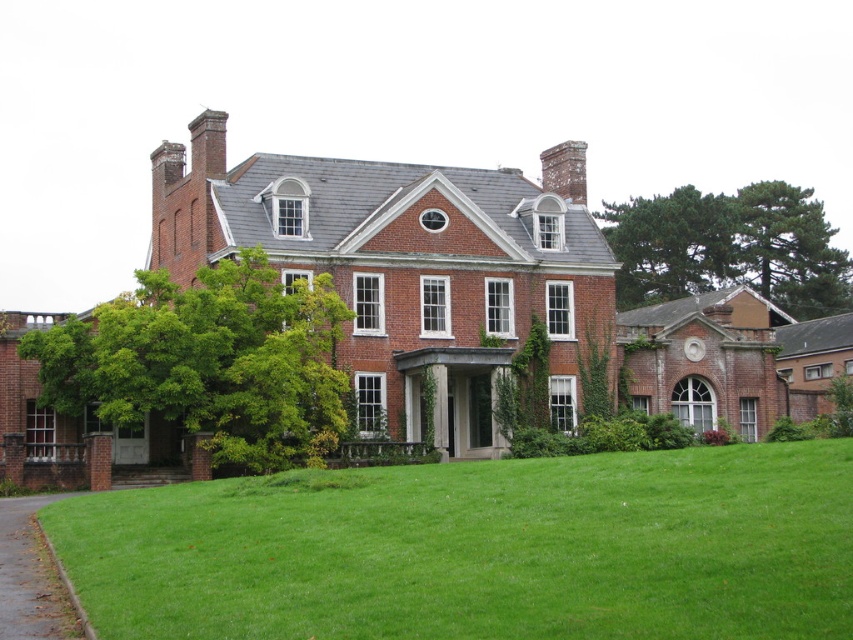
Question: Estimate the real-world distances between objects in this image. Which object is closer to the green leafy tree at upper right?

Choices:
 (A) green leafy tree at left
 (B) green grass at lower left

Answer: (A)

Question: Which point is closer to the camera taking this photo?

Choices:
 (A) (776, 506)
 (B) (90, 376)
 (C) (392, 176)
 (D) (776, 225)

Answer: (A)

Question: Is brick mansion at center smaller than green grass at lower left?

Choices:
 (A) yes
 (B) no

Answer: (B)

Question: Is green leafy tree at left thinner than green leafy tree at upper right?

Choices:
 (A) no
 (B) yes

Answer: (B)

Question: Does green grass at lower left have a lesser width compared to green leafy tree at left?

Choices:
 (A) yes
 (B) no

Answer: (B)

Question: Which of the following is the closest to the observer?

Choices:
 (A) (263, 369)
 (B) (811, 294)
 (C) (793, 477)
 (D) (341, 321)

Answer: (C)